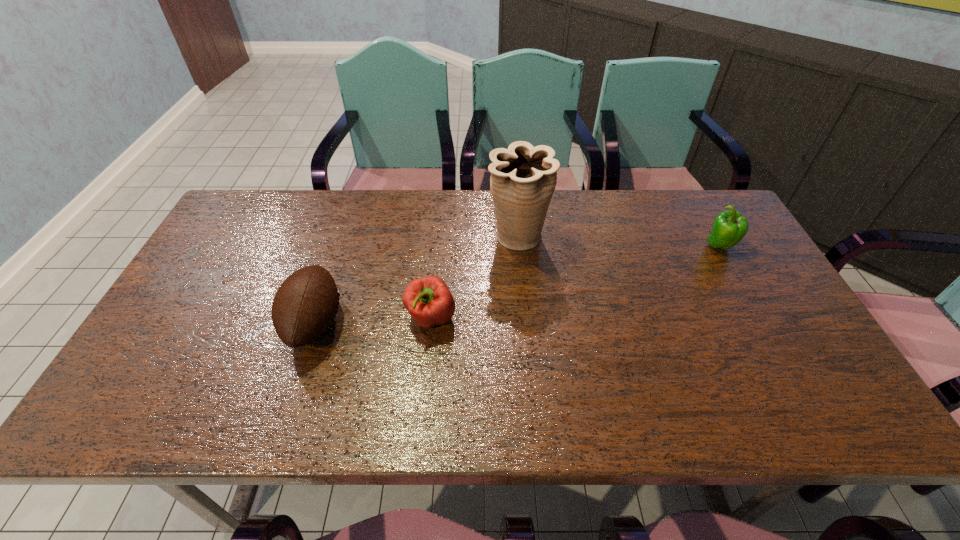
Locate an element on the screen. This screenshot has height=540, width=960. blank area located 0.280m on the back of the shortest object is located at coordinates (440, 231).

Find the location of a particular element. The height and width of the screenshot is (540, 960). urn that is at the far edge is located at coordinates (523, 178).

Where is `bell pepper positioned at the far edge`? The width and height of the screenshot is (960, 540). bell pepper positioned at the far edge is located at coordinates (729, 227).

What are the coordinates of `object located in the right edge section of the desktop` in the screenshot? It's located at (729, 227).

Identify the location of object that is at the far right corner. Image resolution: width=960 pixels, height=540 pixels. (729, 227).

Locate an element on the screen. This screenshot has height=540, width=960. free location at the far edge is located at coordinates (298, 219).

At what (x,y) coordinates should I click in order to perform the action: click on free space at the near edge of the desktop. Please return your answer as a coordinate pair (x, y). Looking at the image, I should click on (237, 396).

Identify the location of free space at the right edge. The image size is (960, 540). (807, 344).

Where is `vacant space at the far left corner of the desktop`? vacant space at the far left corner of the desktop is located at coordinates (233, 225).

The image size is (960, 540). In the image, there is a desktop. Identify the location of vacant space at the far right corner. (x=679, y=194).